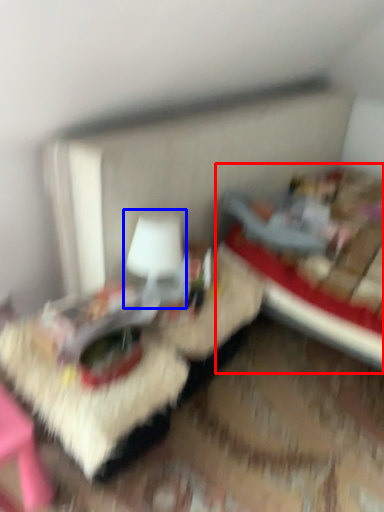
Question: Which object is closer to the camera taking this photo, bed (highlighted by a red box) or table lamp (highlighted by a blue box)?

Choices:
 (A) bed
 (B) table lamp

Answer: (A)